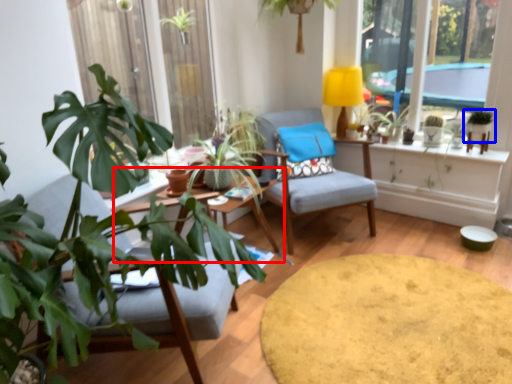
Question: Which object appears farthest to the camera in this image, round table (highlighted by a red box) or houseplant (highlighted by a blue box)?

Choices:
 (A) round table
 (B) houseplant

Answer: (B)